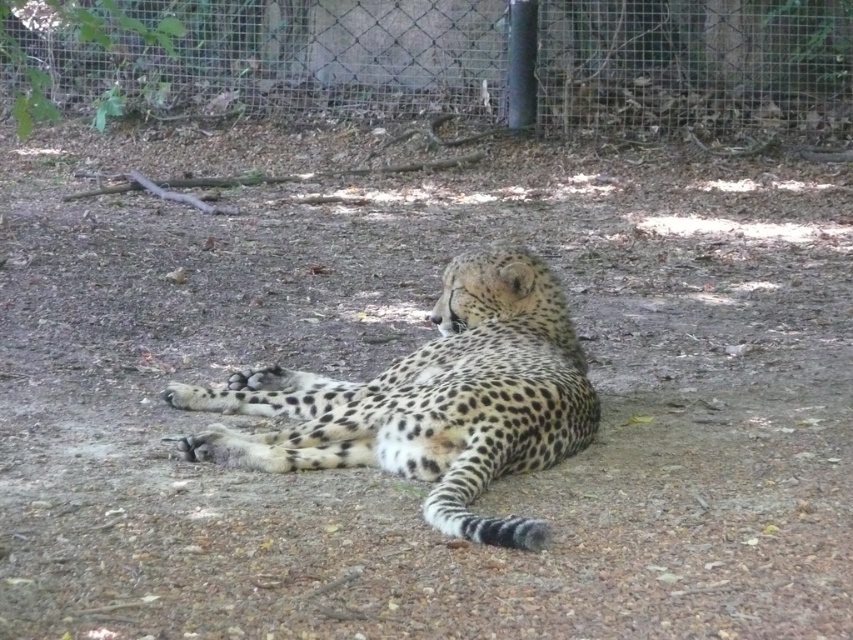
You are a zookeeper trying to feed the spotted fur cheetah at center. The wire mesh fence at center is between you and the cheetah. Can you reach the cheetah to give it food?

The spotted fur cheetah at center is behind the wire mesh fence at center, so you cannot reach the cheetah to give it food directly through the fence.

You are a zookeeper planning to install a new feeding station in the enclosure. The feeding station must be placed at least 2 meters away from the wire mesh fence at center to ensure the cheetah feels secure. Given the enclosure is 10 meters long, can you place the feeding station at the point labeled point (486, 60)?

The point labeled point (486, 60) corresponds to the wire mesh fence at center. Since the feeding station must be placed at least 2 meters away from the wire mesh fence at center, placing it at this point would violate the safety requirement. Choose a different location farther away from the wire mesh fence at center.

You are a zookeeper standing in front of the cheetah enclosure. You notice two points marked in the image. Which point, point (642, 109) or point (457, 292), is closer to you?

Point (642, 109) is further to the viewer than point (457, 292), so the point closer to you is point (457, 292).